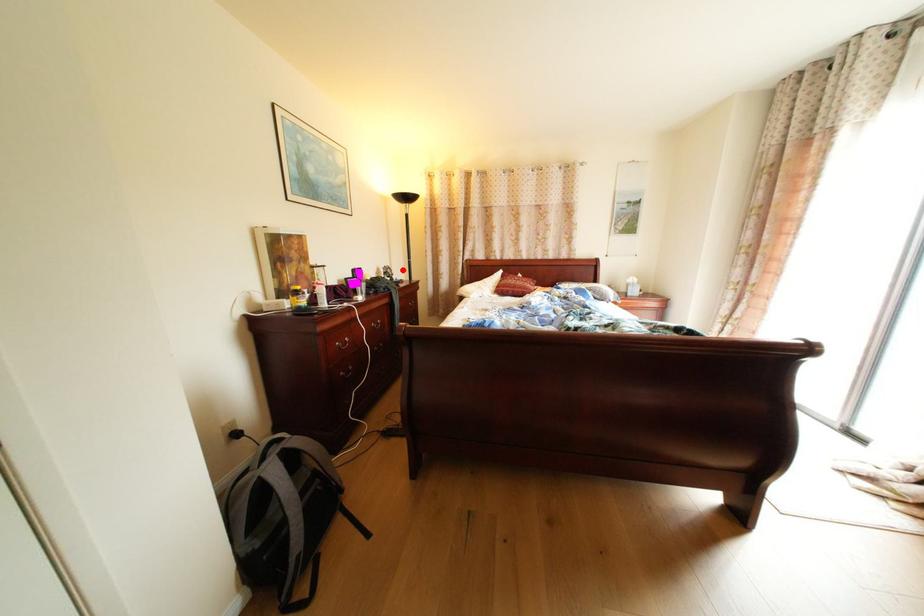
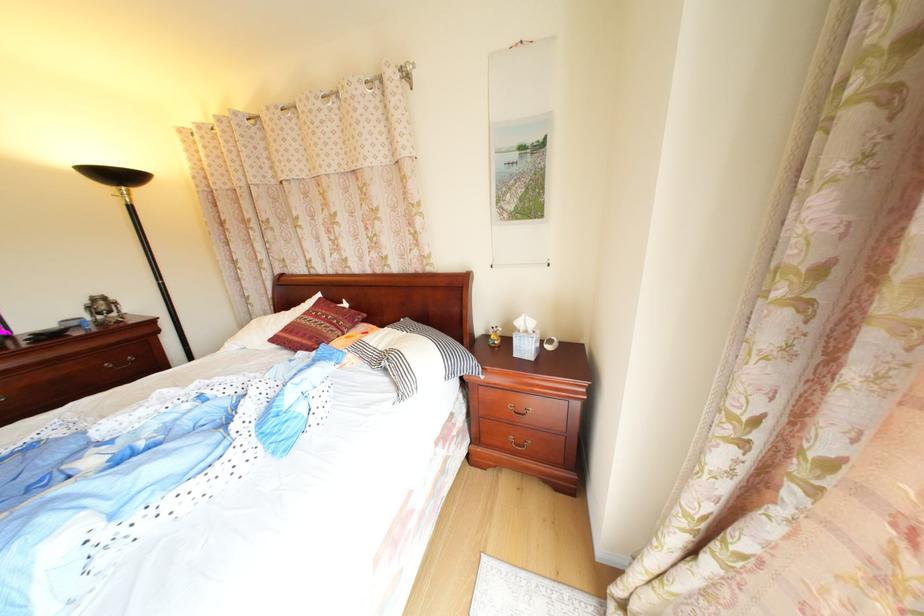
Find the pixel in the second image that matches the highlighted location in the first image.

(116, 301)